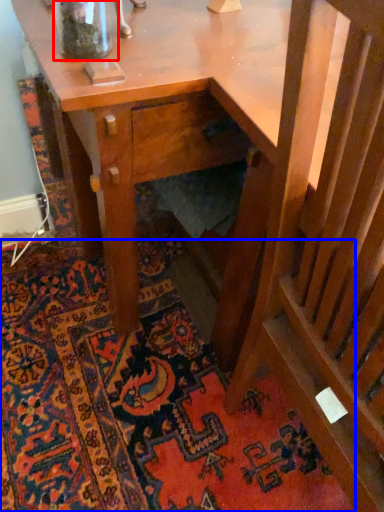
Question: Which of the following is the closest to the observer, glass vase (highlighted by a red box) or mat (highlighted by a blue box)?

Choices:
 (A) glass vase
 (B) mat

Answer: (A)